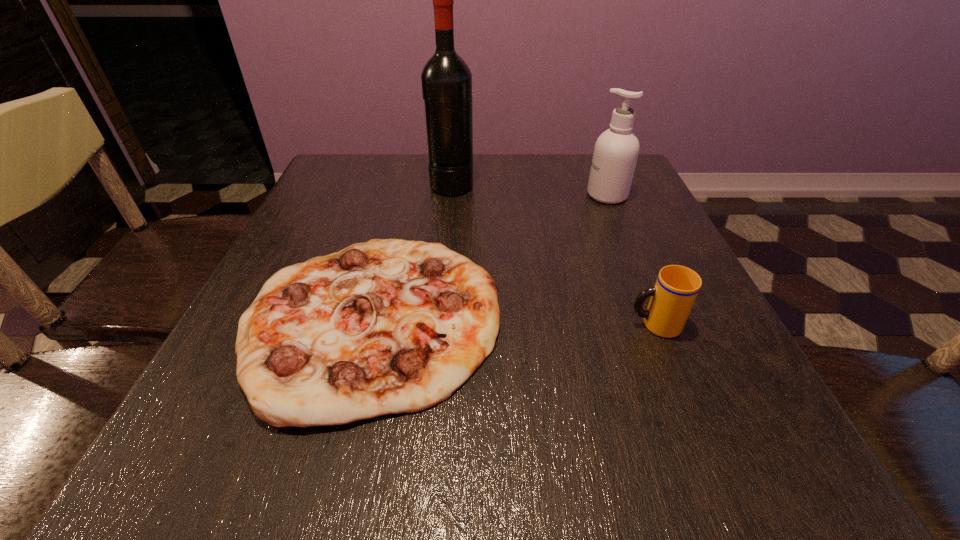
The width and height of the screenshot is (960, 540). In order to click on vacant area that lies between the shortest object and the cleansing agent in this screenshot , I will do `click(490, 257)`.

Locate an element on the screen. The width and height of the screenshot is (960, 540). object that is the third closest one to the tallest object is located at coordinates (672, 298).

Point out which object is positioned as the third nearest to the pizza. Please provide its 2D coordinates. Your answer should be formatted as a tuple, i.e. [(x, y)], where the tuple contains the x and y coordinates of a point satisfying the conditions above.

[(616, 151)]

Find the location of a particular element. Image resolution: width=960 pixels, height=540 pixels. vacant position in the image that satisfies the following two spatial constraints: 1. on the front label of the cleansing agent; 2. on the front side of the pizza is located at coordinates (660, 319).

This screenshot has width=960, height=540. Find the location of `blank area in the image that satisfies the following two spatial constraints: 1. on the front side of the wine bottle; 2. on the side of the second shortest object with the handle`. blank area in the image that satisfies the following two spatial constraints: 1. on the front side of the wine bottle; 2. on the side of the second shortest object with the handle is located at coordinates pos(438,325).

Find the location of a particular element. free point that satisfies the following two spatial constraints: 1. on the front side of the wine bottle; 2. on the side of the third tallest object with the handle is located at coordinates (438, 325).